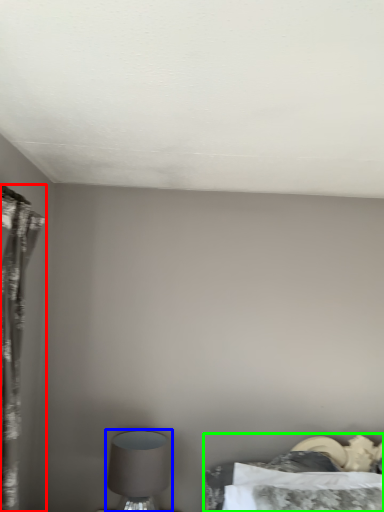
Question: Considering the real-world distances, which object is farthest from curtain (highlighted by a red box)? table lamp (highlighted by a blue box) or bed (highlighted by a green box)?

Choices:
 (A) table lamp
 (B) bed

Answer: (B)